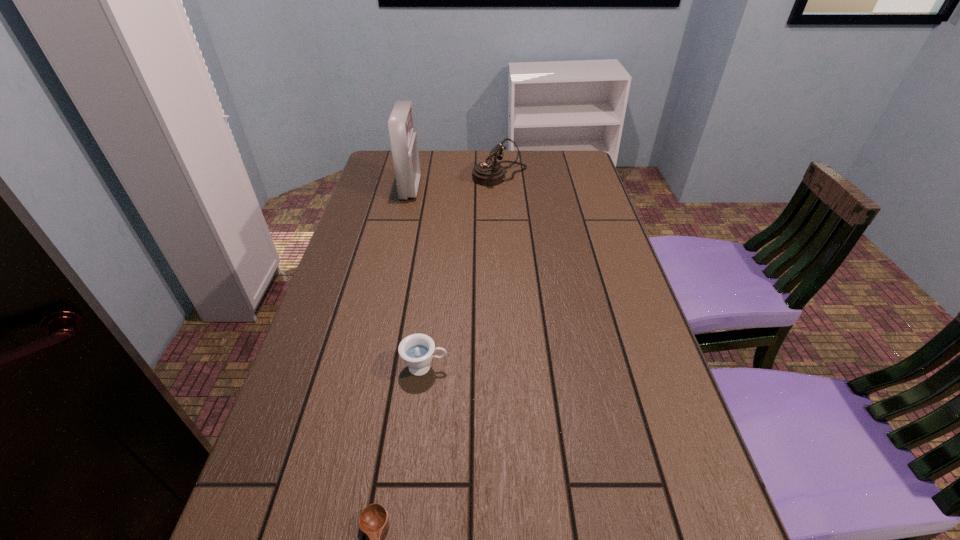
Locate an element on the screen. This screenshot has width=960, height=540. telephone located in the far edge section of the desktop is located at coordinates coord(489,173).

Where is `object located in the left edge section of the desktop`? Image resolution: width=960 pixels, height=540 pixels. object located in the left edge section of the desktop is located at coordinates (404, 144).

You are a GUI agent. You are given a task and a screenshot of the screen. Output one action in this format:
    pyautogui.click(x=<x>, y=<y>)
    Task: Click on the object that is positioned at the far left corner
    This screenshot has height=540, width=960.
    Given the screenshot: What is the action you would take?
    pyautogui.click(x=404, y=144)

Image resolution: width=960 pixels, height=540 pixels. What are the coordinates of `vacant space at the far edge of the desktop` in the screenshot? It's located at (464, 171).

The height and width of the screenshot is (540, 960). I want to click on vacant point at the left edge, so click(302, 409).

The image size is (960, 540). Identify the location of vacant region at the right edge of the desktop. (633, 387).

This screenshot has width=960, height=540. I want to click on vacant space at the far left corner, so click(387, 157).

At what (x,y) coordinates should I click in order to perform the action: click on free region at the far right corner of the desktop. Please return your answer as a coordinate pair (x, y). The image size is (960, 540). Looking at the image, I should click on (564, 163).

This screenshot has height=540, width=960. Find the location of `free space between the rightmost object and the tallest object`. free space between the rightmost object and the tallest object is located at coordinates (455, 181).

This screenshot has height=540, width=960. I want to click on empty location between the third farthest object and the first-aid kit, so pyautogui.click(x=418, y=278).